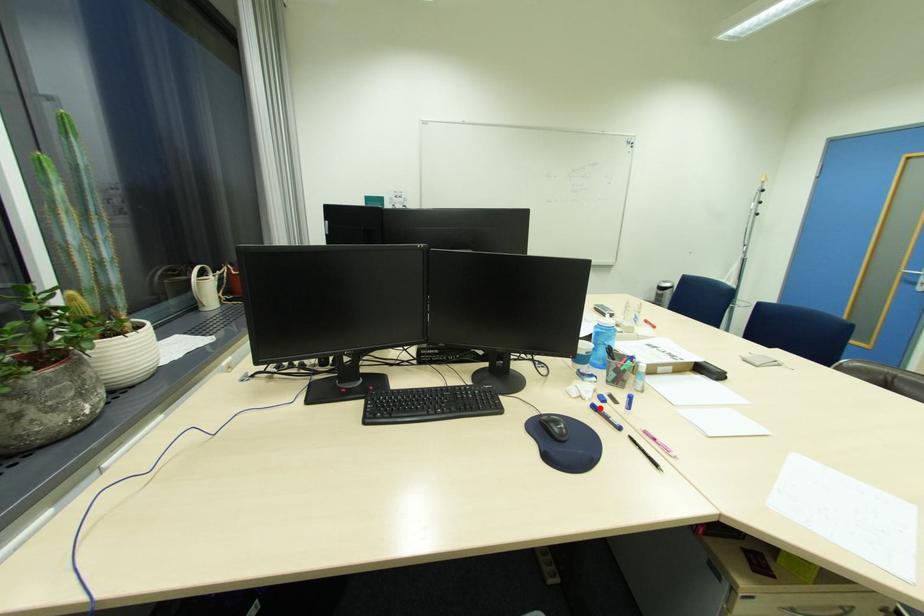
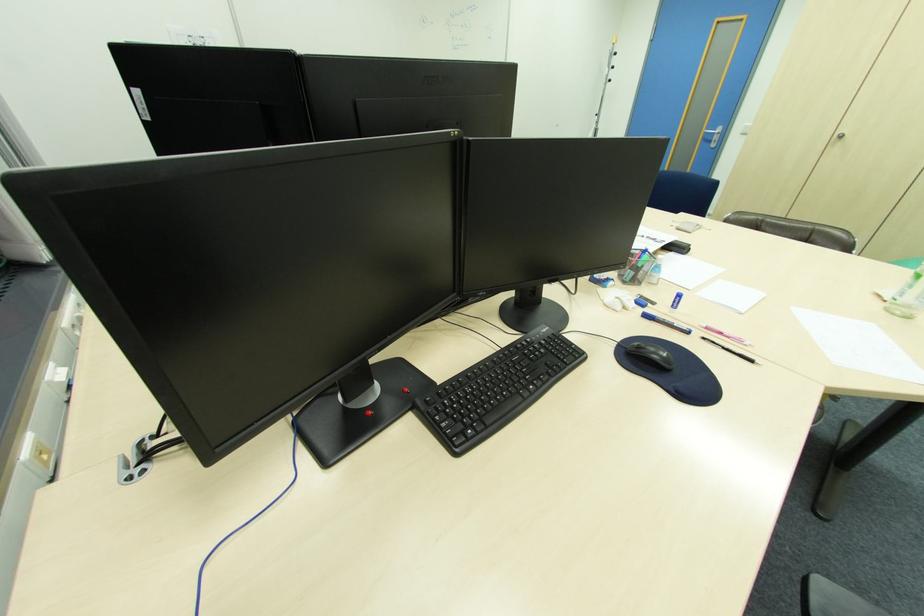
In the second image, find the point that corresponds to the highlighted location in the first image.

(651, 315)